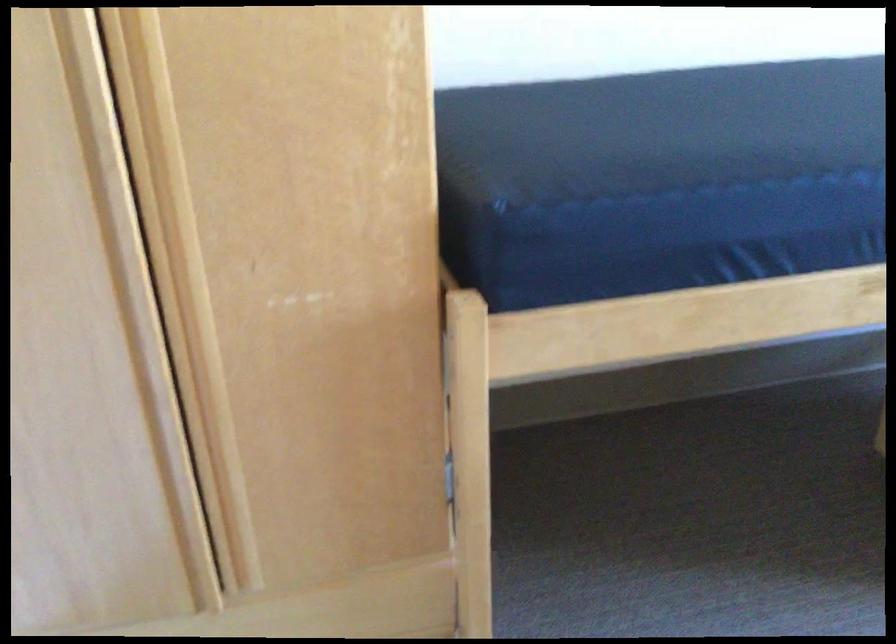
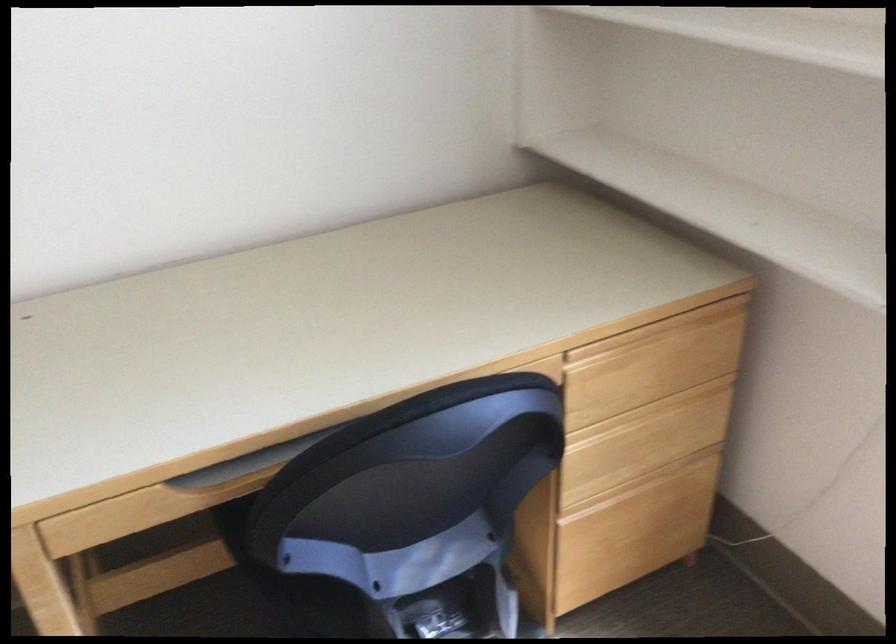
Question: The images are taken continuously from a first-person perspective. In which direction are you moving?

Choices:
 (A) Left
 (B) Right
 (C) Forward
 (D) Backward

Answer: (B)